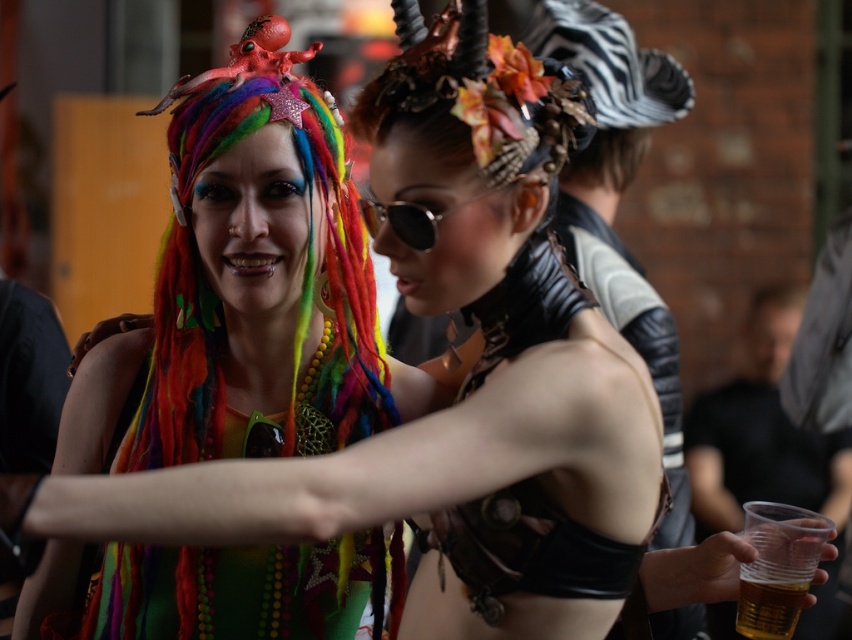
You are at a festival and want to know which object is bigger between the rainbow fabric headdress at upper left and the translucent plastic cup at lower right. Can you tell me?

The rainbow fabric headdress at upper left has a larger size compared to the translucent plastic cup at lower right, so the rainbow fabric headdress at upper left is bigger.